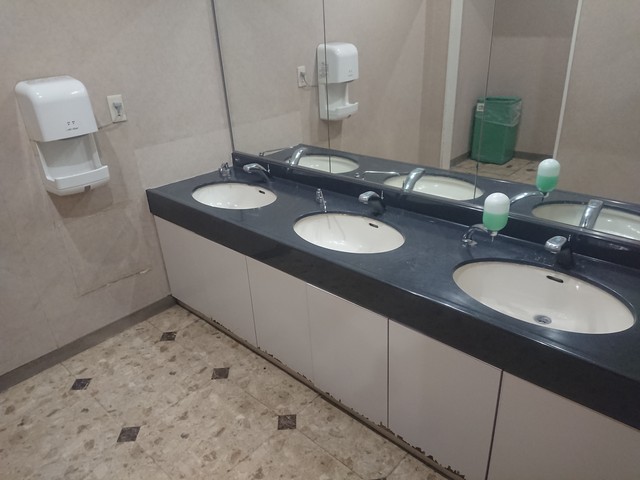
The height and width of the screenshot is (480, 640). In order to click on sink overflow drain in this screenshot , I will do `click(372, 225)`.